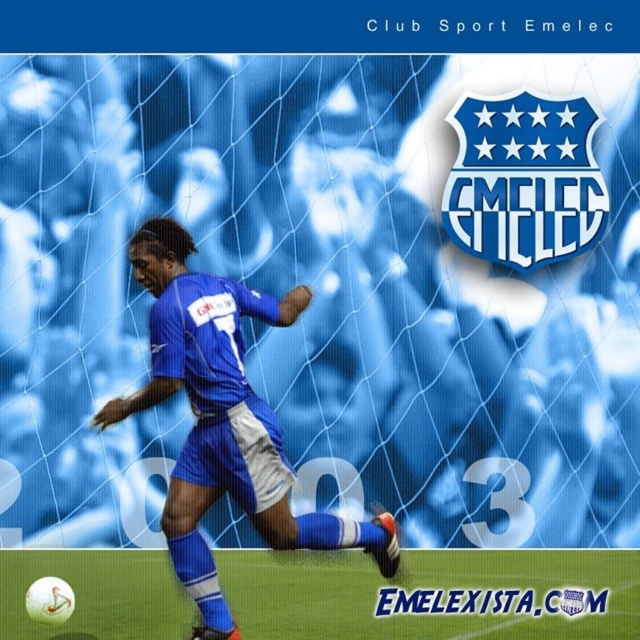
Does green grass at center appear on the left side of blue fabric soccer player at center?

Incorrect, green grass at center is not on the left side of blue fabric soccer player at center.

Who is more distant from viewer, (362, 570) or (284, 544)?

The point (362, 570) is more distant.

I want to click on green grass at center, so click(435, 595).